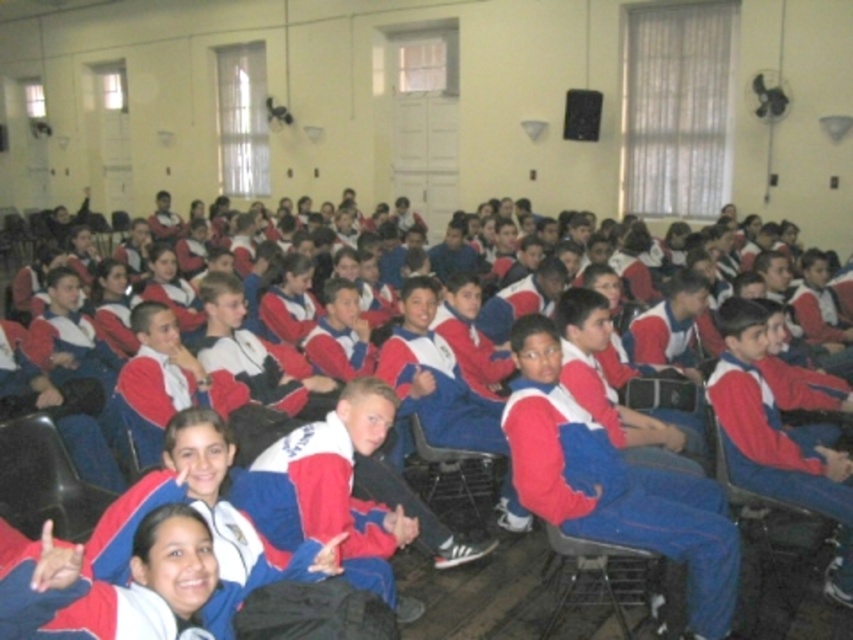
In the scene shown: You are a student trying to reach the whiteboard at the front of the classroom. You are sitting in the metallic gray chair at lower center. Would you need to stand up to see the whiteboard better if the metallic gray chair at center is the standard chair height?

The metallic gray chair at lower center is shorter than the metallic gray chair at center. Since the standard chair height is provided by the metallic gray chair at center, you would need to stand up to see the whiteboard better from the metallic gray chair at lower center.

You are standing at the front of the classroom and want to hand out a note to the student wearing the matte blue jumpsuit at center. There is a metallic gray chair at center in the way. Can you reach the student without moving the chair?

The matte blue jumpsuit at center is closer to the viewer than the metallic gray chair at center, so you can reach the student without moving the chair because the student is in front of the chair.